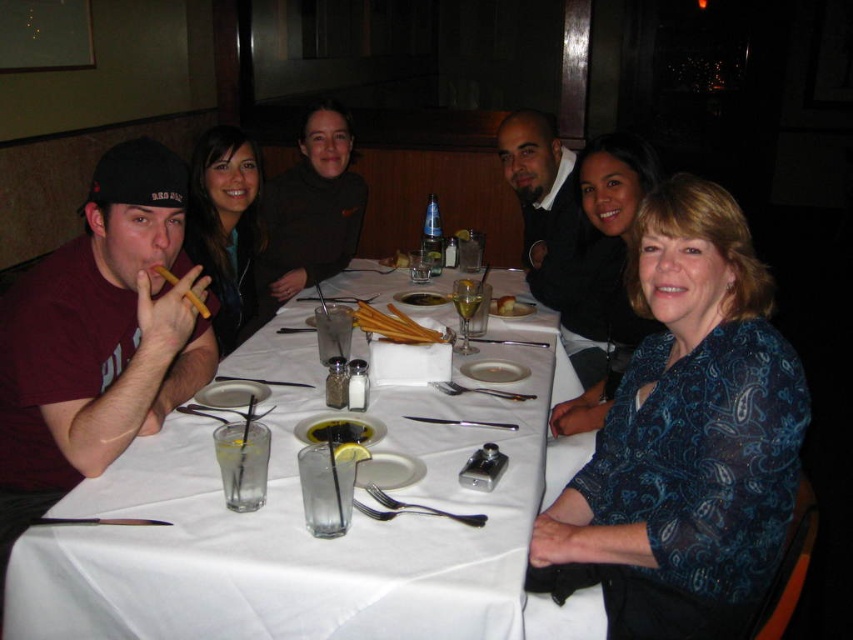
Question: Estimate the real-world distances between objects in this image. Which object is farther from the white cloth table at lower left?

Choices:
 (A) matte black shirt at center
 (B) maroon cotton shirt at left

Answer: (A)

Question: Is matte black shirt at center below yellow croutons at center?

Choices:
 (A) yes
 (B) no

Answer: (B)

Question: Is yellow croutons at center thinner than translucent glass water at center?

Choices:
 (A) no
 (B) yes

Answer: (B)

Question: Considering the real-world distances, which object is closest to the translucent glass water at center?

Choices:
 (A) yellow lemon slice at center
 (B) yellow matte chopsticks at upper left
 (C) matte black shirt at center
 (D) matte black jacket at upper left

Answer: (C)

Question: Which of the following is the closest to the observer?

Choices:
 (A) yellow matte chopsticks at upper left
 (B) matte black shirt at center

Answer: (A)

Question: Is smooth brown breadsticks at center thinner than translucent glass water at center?

Choices:
 (A) yes
 (B) no

Answer: (B)